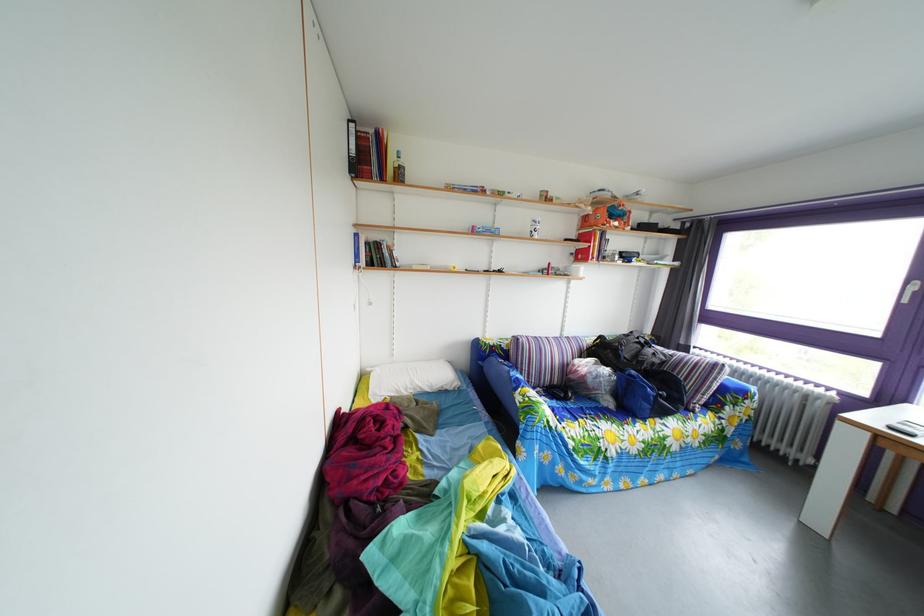
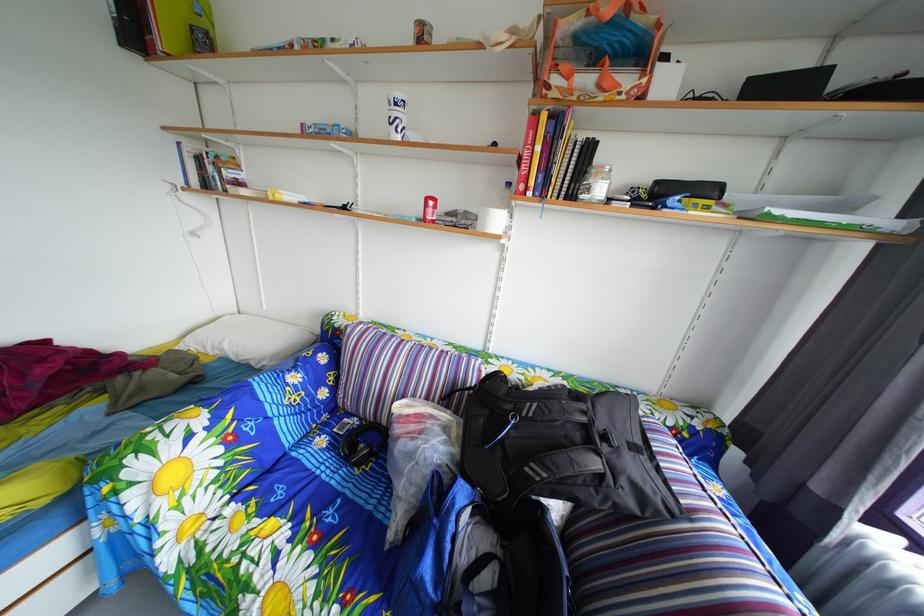
In the second image, find the point that corresponds to the point at 550,398 in the first image.

(367, 428)